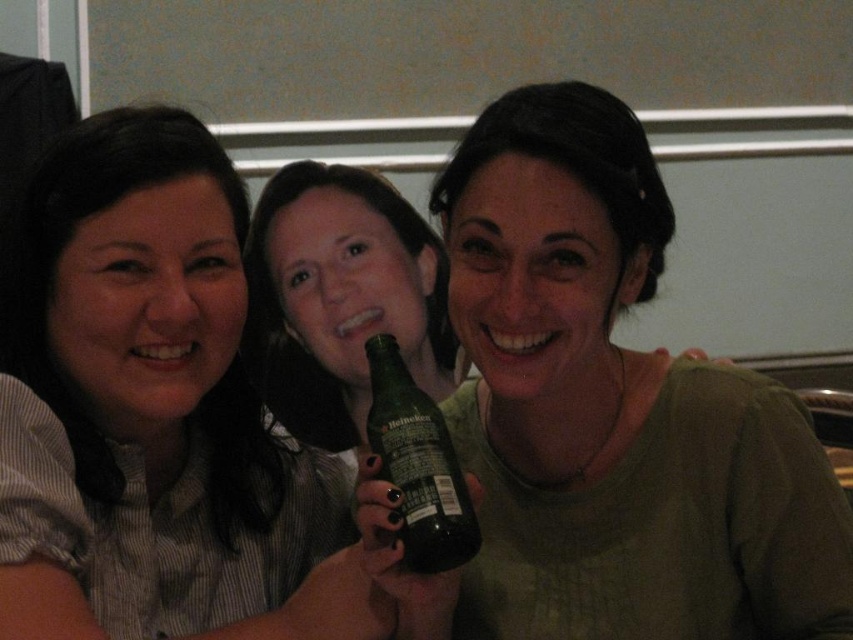
You are taking a photo of the three people sitting together. You notice two points marked in the image. The first point is at coordinate point (521, 596) and the second is at point (125, 540). Which point is closer to the camera?

Point (521, 596) is further to the camera than point (125, 540), so the second point is closer to the camera.

What is the color of the shirt at the point labeled as point (154,412)?

The point (154,412) is on a matte black shirt at left.

You are a bartender preparing to serve drinks. You need to place a coaster under the green matte bottle at center and the matte black shirt at left. Which object requires a larger coaster to fully cover its base?

The green matte bottle at center requires a larger coaster since it has a greater height than the matte black shirt at left.